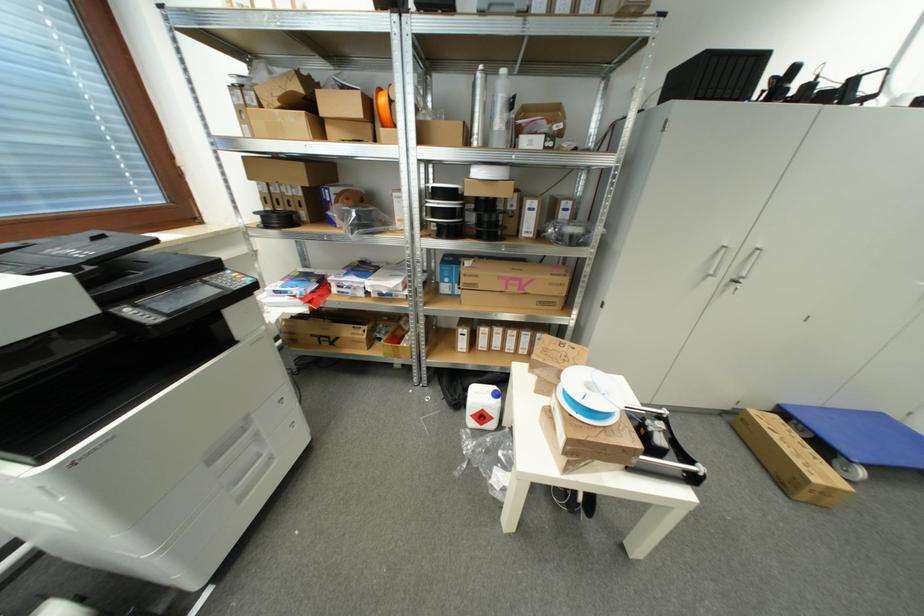
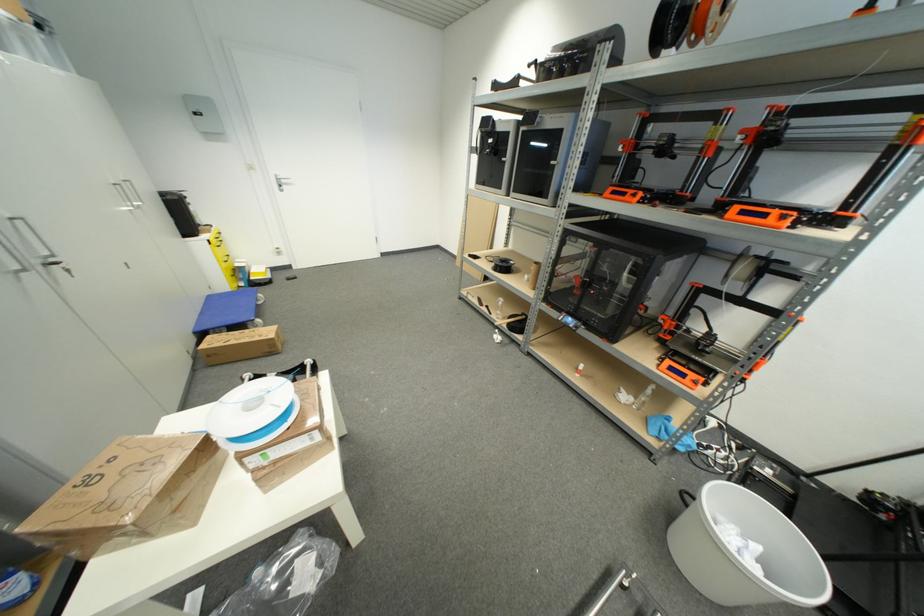
Find the pixel in the second image that matches [781,419] in the first image.

(213, 339)